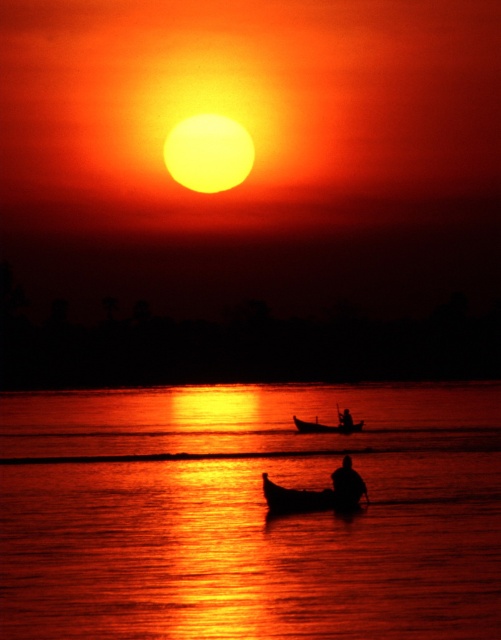
You are standing on the dock and want to place both the smooth wooden boat at center and the black wood paddle at lower center on a shelf. The shelf has a height limit of 1 meter. Can both items fit on the shelf without exceeding the height limit?

The smooth wooden boat at center is taller than the black wood paddle at lower center. However, since the shelf has a height limit of 1 meter, both items can fit as long as the boat does not exceed 1 meter in height. The paddle, being shorter, will definitely fit.

You are planning to take a photo of the silhouette human at center and the black wood paddle at lower center. Which object should you zoom in on to capture more details without moving the camera?

The silhouette human at center should be zoomed in on because its width is larger than the black wood paddle at lower center, allowing for more detailed capture without moving the camera.